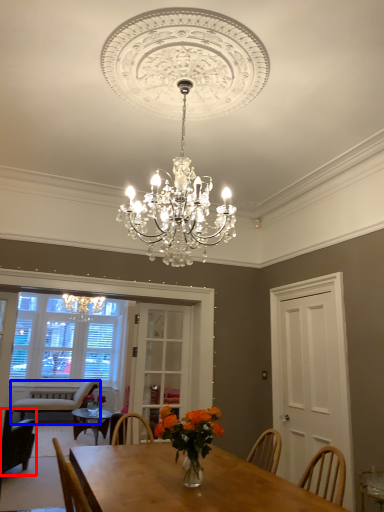
Question: Which object is closer to the camera taking this photo, chair (highlighted by a red box) or chair (highlighted by a blue box)?

Choices:
 (A) chair
 (B) chair

Answer: (A)